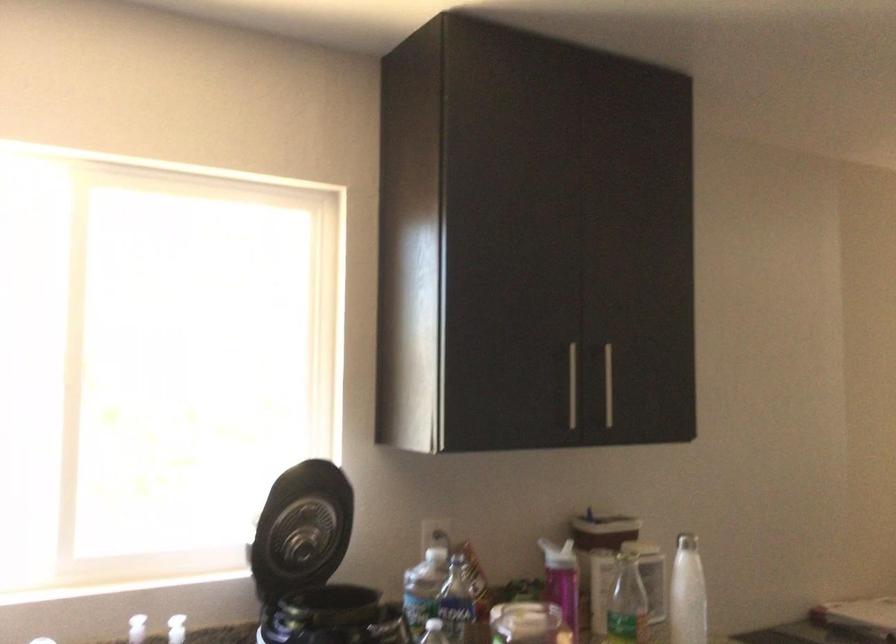
Where is `white bottle`? Image resolution: width=896 pixels, height=644 pixels. white bottle is located at coordinates (687, 592).